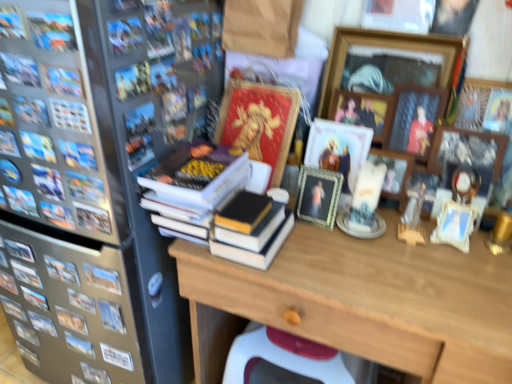
Locate an element on the screen. The height and width of the screenshot is (384, 512). spots to the right of hardcover books at center, positioned as the 2th book in top-to-bottom order is located at coordinates (335, 260).